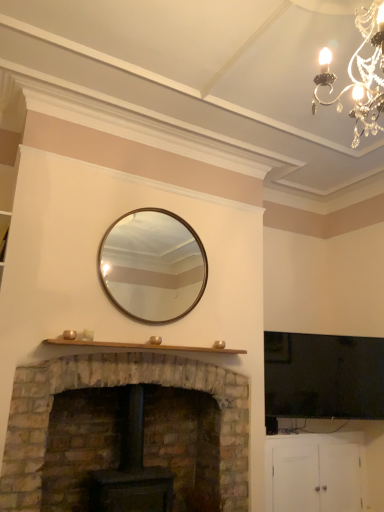
The width and height of the screenshot is (384, 512). Describe the element at coordinates (360, 75) in the screenshot. I see `crystal chandelier at upper right` at that location.

Image resolution: width=384 pixels, height=512 pixels. In order to click on crystal chandelier at upper right in this screenshot , I will do `click(360, 75)`.

The image size is (384, 512). What are the coordinates of `white matte cabinet at lower right` in the screenshot? It's located at (314, 473).

Find the location of a particular element. silver metallic mirror at center is located at coordinates [153, 265].

Considering the positions of objects rustic stone fireplace at lower left and silver metallic mirror at center in the image provided, who is in front, rustic stone fireplace at lower left or silver metallic mirror at center?

rustic stone fireplace at lower left is more forward.

Considering the relative positions of rustic stone fireplace at lower left and silver metallic mirror at center in the image provided, is rustic stone fireplace at lower left to the left of silver metallic mirror at center from the viewer's perspective?

Indeed, rustic stone fireplace at lower left is positioned on the left side of silver metallic mirror at center.

Does rustic stone fireplace at lower left have a lesser width compared to silver metallic mirror at center?

No.

From a real-world perspective, is rustic stone fireplace at lower left under silver metallic mirror at center?

Correct, in the physical world, rustic stone fireplace at lower left is lower than silver metallic mirror at center.

Can you tell me how much crystal chandelier at upper right and silver metallic mirror at center differ in facing direction?

0.527 degrees separate the facing orientations of crystal chandelier at upper right and silver metallic mirror at center.

From a real-world perspective, is crystal chandelier at upper right physically located above or below silver metallic mirror at center?

crystal chandelier at upper right is above silver metallic mirror at center.

Who is smaller, crystal chandelier at upper right or silver metallic mirror at center?

Smaller between the two is silver metallic mirror at center.

Based on the photo, is crystal chandelier at upper right at the left side of silver metallic mirror at center?

In fact, crystal chandelier at upper right is to the right of silver metallic mirror at center.

Who is smaller, crystal chandelier at upper right or rustic stone fireplace at lower left?

Smaller between the two is crystal chandelier at upper right.

From the image's perspective, is crystal chandelier at upper right on rustic stone fireplace at lower left?

Indeed, from the image's perspective, crystal chandelier at upper right is shown above rustic stone fireplace at lower left.

Is point (317, 83) closer to camera compared to point (187, 372)?

Yes, point (317, 83) is closer to viewer.

Is crystal chandelier at upper right to the right of rustic stone fireplace at lower left from the viewer's perspective?

Yes, crystal chandelier at upper right is to the right of rustic stone fireplace at lower left.

Is rustic stone fireplace at lower left located outside crystal chandelier at upper right?

rustic stone fireplace at lower left is positioned outside crystal chandelier at upper right.

How different are the orientations of rustic stone fireplace at lower left and crystal chandelier at upper right in degrees?

They differ by 0.587 degrees in their facing directions.

From the picture: Between rustic stone fireplace at lower left and crystal chandelier at upper right, which one appears on the right side from the viewer's perspective?

From the viewer's perspective, crystal chandelier at upper right appears more on the right side.

Between point (247, 484) and point (368, 38), which one is positioned behind?

The point (247, 484) is more distant.

Could you tell me if silver metallic mirror at center is turned towards white matte cabinet at lower right?

No, silver metallic mirror at center is not facing towards white matte cabinet at lower right.

Does point (141, 301) come farther from viewer compared to point (330, 449)?

No.

In the scene shown: Is the position of silver metallic mirror at center more distant than that of white matte cabinet at lower right?

That is False.

Identify the location of mirror above the white matte cabinet at lower right (from a real-world perspective). This screenshot has width=384, height=512. (153, 265).

Can you tell me how much rustic stone fireplace at lower left and white matte cabinet at lower right differ in facing direction?

There is a 0.248-degree angle between the facing directions of rustic stone fireplace at lower left and white matte cabinet at lower right.

Which object is thinner, rustic stone fireplace at lower left or white matte cabinet at lower right?

With smaller width is white matte cabinet at lower right.

Considering the points (162, 377) and (329, 469), which point is behind, point (162, 377) or point (329, 469)?

The point (329, 469) is farther from the camera.

Considering the sizes of rustic stone fireplace at lower left and white matte cabinet at lower right in the image, is rustic stone fireplace at lower left bigger or smaller than white matte cabinet at lower right?

rustic stone fireplace at lower left is bigger than white matte cabinet at lower right.

Which is farther from the camera, (360, 106) or (294, 456)?

The point (294, 456) is behind.

Would you say crystal chandelier at upper right is a long distance from white matte cabinet at lower right?

That's right, there is a large distance between crystal chandelier at upper right and white matte cabinet at lower right.

Considering the sizes of objects crystal chandelier at upper right and white matte cabinet at lower right in the image provided, who is taller, crystal chandelier at upper right or white matte cabinet at lower right?

Standing taller between the two is crystal chandelier at upper right.

Is white matte cabinet at lower right completely or partially inside crystal chandelier at upper right?

No.

Identify the location of fireplace beneath the silver metallic mirror at center (from a real-world perspective). The width and height of the screenshot is (384, 512). (112, 386).

This screenshot has height=512, width=384. I want to click on lamp above the silver metallic mirror at center (from a real-world perspective), so click(360, 75).

Which object lies nearer to the anchor point white matte cabinet at lower right, rustic stone fireplace at lower left or silver metallic mirror at center?

Based on the image, rustic stone fireplace at lower left appears to be nearer to white matte cabinet at lower right.

Estimate the real-world distances between objects in this image. Which object is closer to white matte cabinet at lower right, crystal chandelier at upper right or rustic stone fireplace at lower left?

The object closer to white matte cabinet at lower right is rustic stone fireplace at lower left.

Estimate the real-world distances between objects in this image. Which object is closer to white matte cabinet at lower right, crystal chandelier at upper right or silver metallic mirror at center?

Based on the image, silver metallic mirror at center appears to be nearer to white matte cabinet at lower right.

Considering their positions, is silver metallic mirror at center positioned further to rustic stone fireplace at lower left than white matte cabinet at lower right?

Among the two, white matte cabinet at lower right is located further to rustic stone fireplace at lower left.

Looking at the image, which one is located closer to crystal chandelier at upper right, white matte cabinet at lower right or silver metallic mirror at center?

Among the two, silver metallic mirror at center is located nearer to crystal chandelier at upper right.

Based on the photo, based on their spatial positions, is rustic stone fireplace at lower left or crystal chandelier at upper right further from silver metallic mirror at center?

crystal chandelier at upper right is positioned further to the anchor silver metallic mirror at center.

Considering their positions, is rustic stone fireplace at lower left positioned further to silver metallic mirror at center than white matte cabinet at lower right?

Among the two, white matte cabinet at lower right is located further to silver metallic mirror at center.

Looking at the image, which one is located further to crystal chandelier at upper right, rustic stone fireplace at lower left or silver metallic mirror at center?

Among the two, rustic stone fireplace at lower left is located further to crystal chandelier at upper right.

In order to click on fireplace between crystal chandelier at upper right and white matte cabinet at lower right in the vertical direction in this screenshot , I will do `click(112, 386)`.

The image size is (384, 512). I want to click on mirror that lies between crystal chandelier at upper right and rustic stone fireplace at lower left from top to bottom, so click(x=153, y=265).

Locate an element on the screen. mirror that lies between crystal chandelier at upper right and white matte cabinet at lower right from top to bottom is located at coordinates (153, 265).

I want to click on fireplace between silver metallic mirror at center and white matte cabinet at lower right in the vertical direction, so click(x=112, y=386).